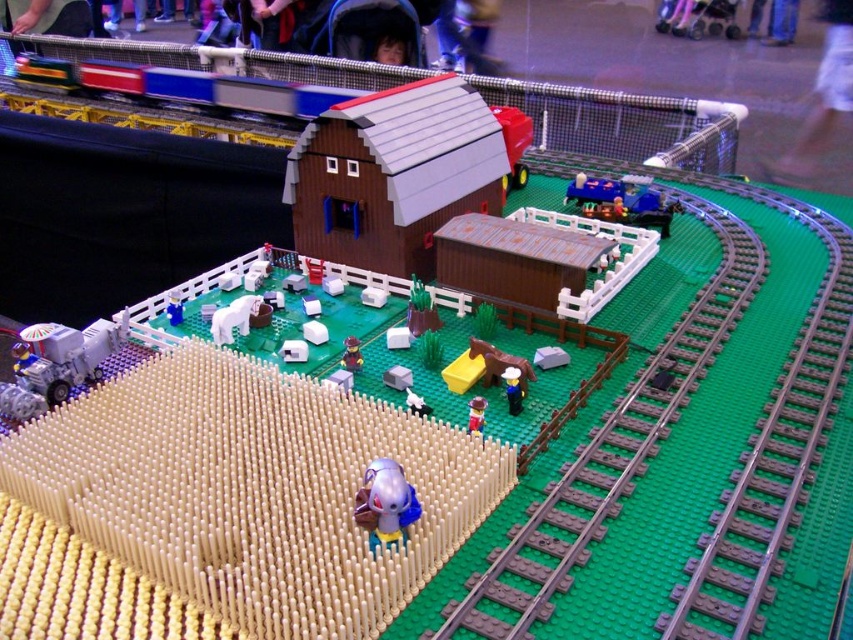
You are a toy collector who wants to place a new 3.5 inch tall action figure between the smooth plastic figure at center and the translucent purple figure at center. Can you fit it in the space between them?

The smooth plastic figure at center is 7.69 inches from the translucent purple figure at center. Since the action figure is only 3.5 inches tall, it can easily fit in the space between them as the distance is greater than the height of the action figure.